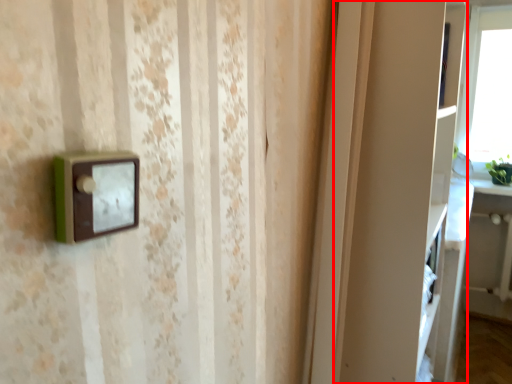
Question: From the image's perspective, what is the correct spatial relationship of cabinet (annotated by the red box) in relation to table?

Choices:
 (A) above
 (B) below

Answer: (A)